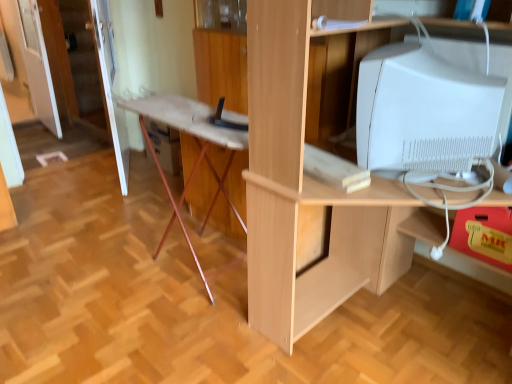
The height and width of the screenshot is (384, 512). Identify the location of vacant space that is to the left of light wood desk at center. (176, 321).